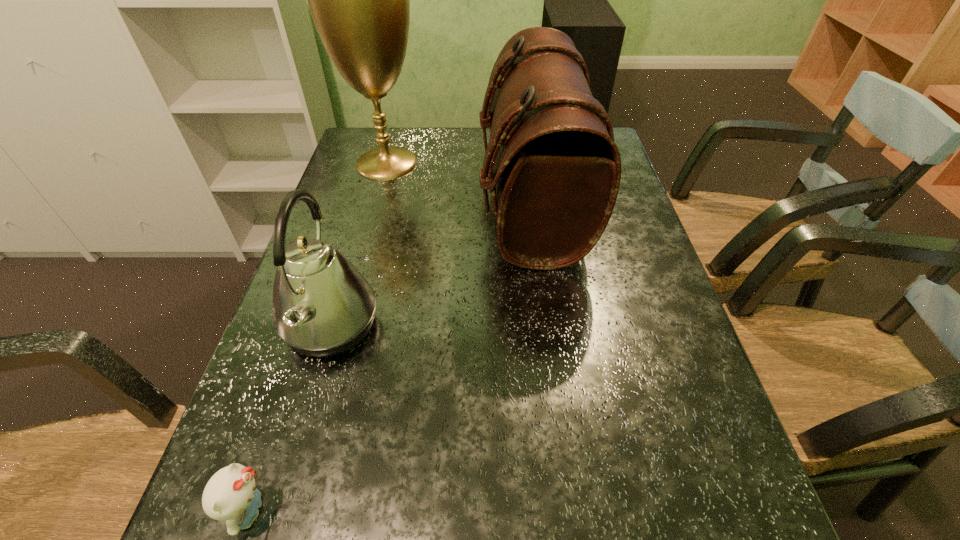
Locate an element on the screen. This screenshot has width=960, height=540. trophy cup is located at coordinates (359, 0).

Find the location of `satchel`. satchel is located at coordinates (557, 170).

Where is `the rightmost object`? Image resolution: width=960 pixels, height=540 pixels. the rightmost object is located at coordinates (557, 170).

Identify the location of the second nearest object. The image size is (960, 540). (322, 306).

The height and width of the screenshot is (540, 960). I want to click on the second shortest object, so click(322, 306).

Find the location of `free location located on the front of the tallest object`. free location located on the front of the tallest object is located at coordinates (355, 278).

You are a GUI agent. You are given a task and a screenshot of the screen. Output one action in this format:
    pyautogui.click(x=<x>, y=<y>)
    Task: Click on the free region located 0.380m on the front-facing side of the third shortest object
    Image resolution: width=960 pixels, height=540 pixels.
    Given the screenshot: What is the action you would take?
    pyautogui.click(x=341, y=202)

Where is `vacant space situated 0.260m on the front-facing side of the third shortest object`? The image size is (960, 540). vacant space situated 0.260m on the front-facing side of the third shortest object is located at coordinates point(385,202).

The width and height of the screenshot is (960, 540). Find the location of `vacant area situated on the front-facing side of the third shortest object`. vacant area situated on the front-facing side of the third shortest object is located at coordinates click(418, 202).

At what (x,y) coordinates should I click in order to perform the action: click on free space located 0.050m from the spout of the kettle. Please return your answer as a coordinate pair (x, y). This screenshot has width=960, height=540. Looking at the image, I should click on (403, 327).